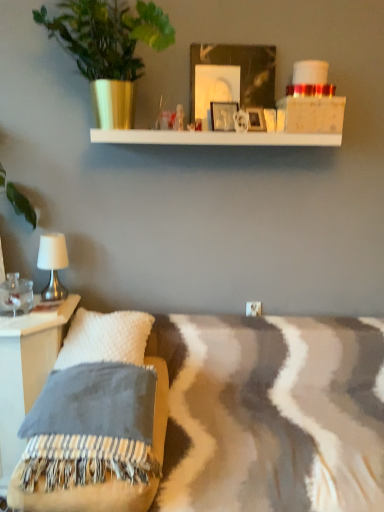
Question: Based on their sizes in the image, would you say green leafy plant in gold pot at upper left is bigger or smaller than metallic silver picture frame at upper center, the first picture frame from the left?

Choices:
 (A) small
 (B) big

Answer: (B)

Question: From a real-world perspective, relative to metallic silver picture frame at upper center, marked as the second picture frame in a right-to-left arrangement, is green leafy plant in gold pot at upper left vertically above or below?

Choices:
 (A) above
 (B) below

Answer: (A)

Question: Which object is the farthest from the metallic silver picture frame at upper center, which appears as the 2th picture frame when viewed from the left?

Choices:
 (A) silver metallic table lamp at left
 (B) metallic silver picture frame at upper center, marked as the second picture frame in a right-to-left arrangement
 (C) green leafy plant in gold pot at upper left
 (D) white fuzzy pillow at lower left

Answer: (D)

Question: Based on their relative distances, which object is farther from the metallic silver picture frame at upper center, the first picture frame from the left?

Choices:
 (A) metallic silver picture frame at upper center, the first picture frame viewed from the right
 (B) green leafy plant in gold pot at upper left
 (C) white fuzzy pillow at lower left
 (D) silver metallic table lamp at left

Answer: (C)